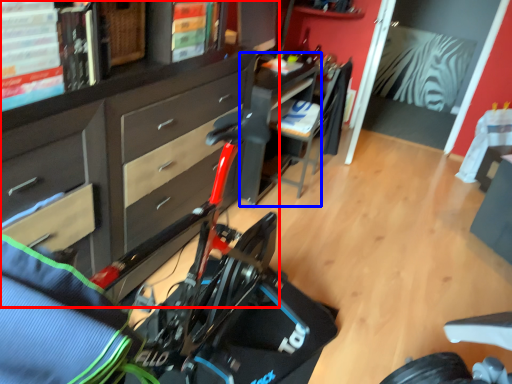
Question: Which object is closer to the camera taking this photo, cabinetry (highlighted by a red box) or table (highlighted by a blue box)?

Choices:
 (A) cabinetry
 (B) table

Answer: (A)